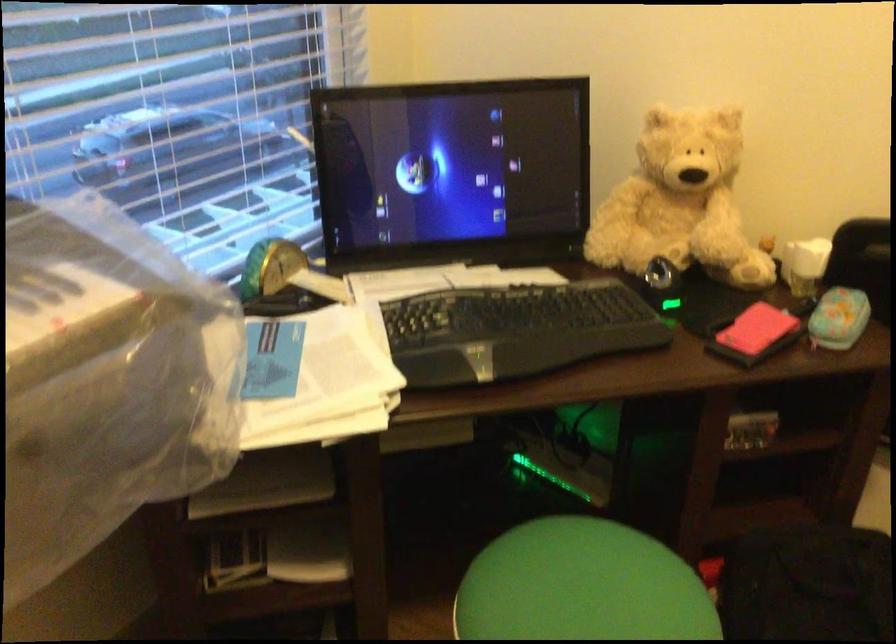
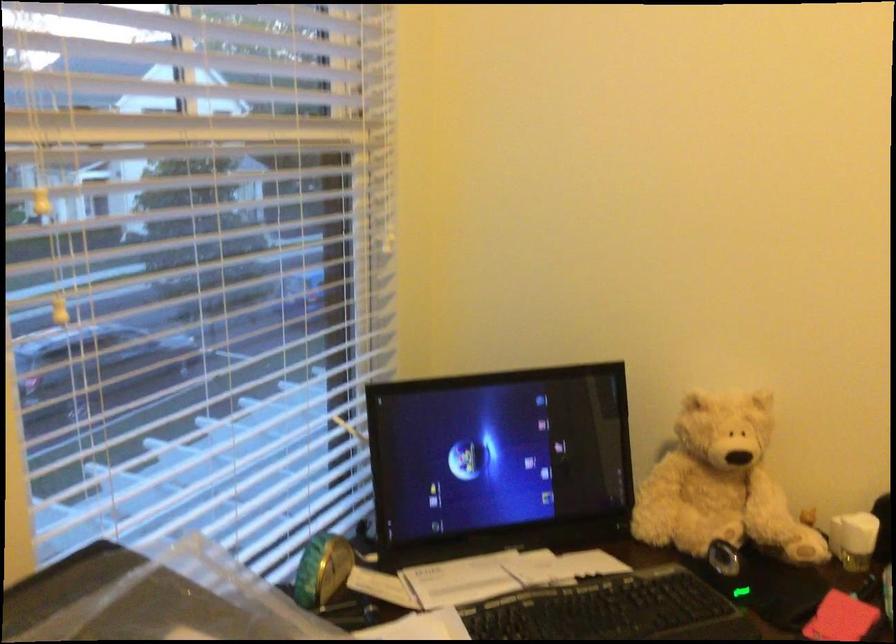
Where in the second image is the point corresponding to (755,328) from the first image?

(840, 618)